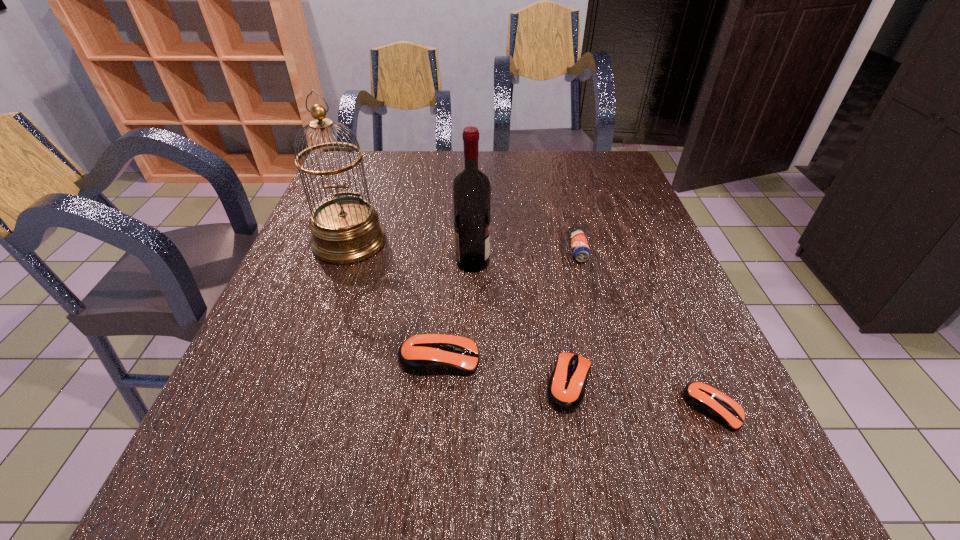
Where is `blank space located 0.120m on the left of the shortest computer mouse`? The image size is (960, 540). blank space located 0.120m on the left of the shortest computer mouse is located at coordinates coord(615,409).

Where is `vacant position located 0.340m with an open door on the leftmost object`? This screenshot has width=960, height=540. vacant position located 0.340m with an open door on the leftmost object is located at coordinates (296, 392).

Where is `free space located 0.070m on the front and back of the alcohol`? This screenshot has height=540, width=960. free space located 0.070m on the front and back of the alcohol is located at coordinates (519, 262).

This screenshot has width=960, height=540. Find the location of `vacant space located 0.140m on the front of the beer can`. vacant space located 0.140m on the front of the beer can is located at coordinates (592, 307).

Locate an element on the screen. The height and width of the screenshot is (540, 960). object present at the left edge is located at coordinates (346, 229).

You are a GUI agent. You are given a task and a screenshot of the screen. Output one action in this format:
    pyautogui.click(x=<x>, y=<y>)
    Task: Click on the object situated at the right edge
    
    Given the screenshot: What is the action you would take?
    pyautogui.click(x=705, y=399)

Find the location of a particular element. Image resolution: width=960 pixels, height=540 pixels. object present at the near right corner is located at coordinates (705, 399).

Identify the location of vacant space at the far edge. The height and width of the screenshot is (540, 960). (401, 171).

At what (x,y) coordinates should I click in order to perform the action: click on free space at the near edge of the desktop. Please return your answer as a coordinate pair (x, y). Looking at the image, I should click on (608, 414).

This screenshot has height=540, width=960. Find the location of `free space at the left edge of the desktop`. free space at the left edge of the desktop is located at coordinates [304, 239].